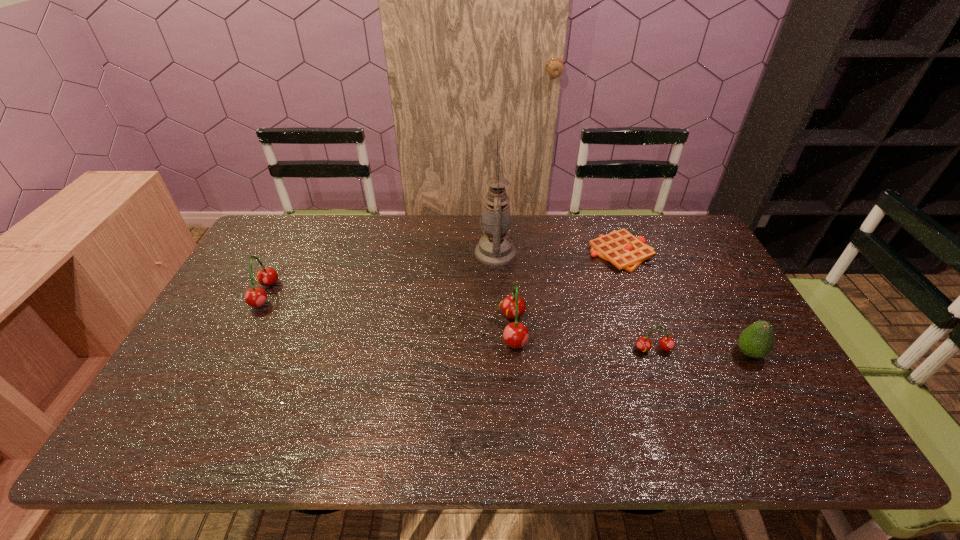
Find the location of `free space that is in between the second cherry from left to right and the shortest object`. free space that is in between the second cherry from left to right and the shortest object is located at coordinates (567, 291).

Identify the location of free spot between the second cherry from left to right and the shortest cherry. Image resolution: width=960 pixels, height=540 pixels. (584, 340).

Identify the location of free space between the tallest object and the avocado. (622, 303).

Locate an element on the screen. This screenshot has width=960, height=540. vacant area between the tallest object and the shortest object is located at coordinates (559, 253).

Find the location of a particular element. vacant area between the second cherry from left to right and the second tallest cherry is located at coordinates tap(389, 312).

Find the location of `free space between the waffle and the shortest cherry`. free space between the waffle and the shortest cherry is located at coordinates (637, 301).

The image size is (960, 540). Identify the location of object that can be found as the closest to the leftmost cherry. (495, 248).

This screenshot has width=960, height=540. In order to click on the fifth closest object to the fourth shortest object in this screenshot , I will do `click(756, 341)`.

The image size is (960, 540). In order to click on cherry that stands as the third closest to the waffle in this screenshot , I will do `click(255, 297)`.

In order to click on cherry identified as the second closest to the second shortest cherry in this screenshot , I will do `click(666, 343)`.